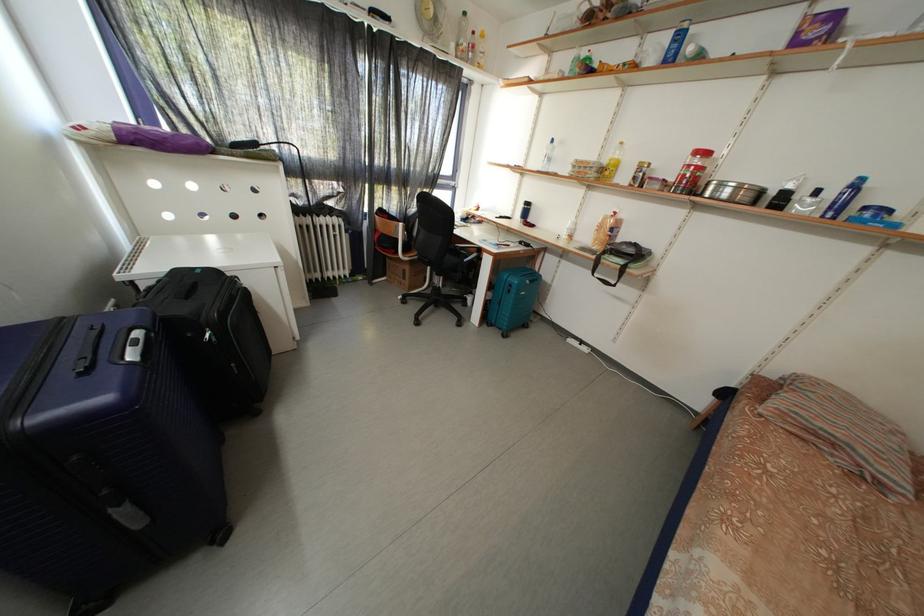
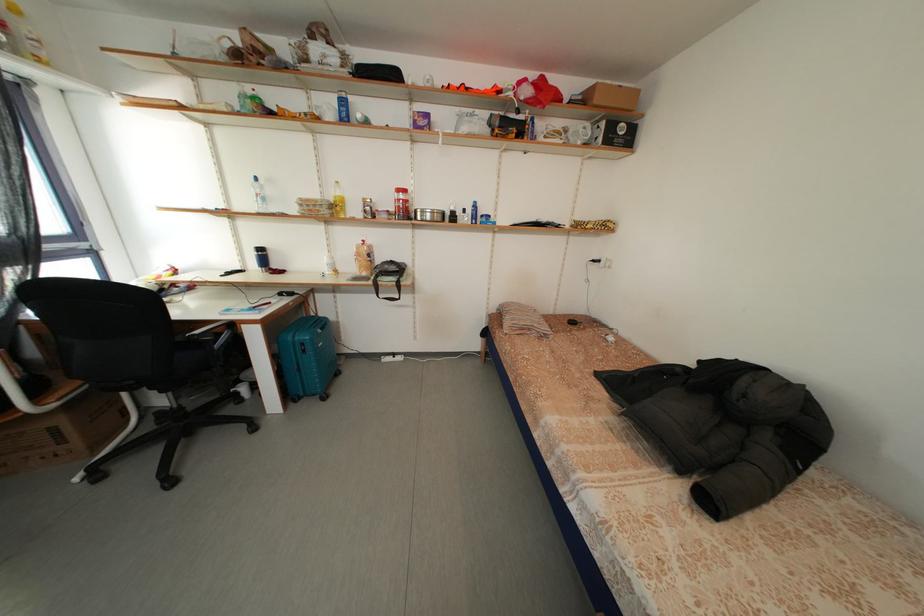
Question: How did the camera likely rotate?

Choices:
 (A) Left
 (B) Right
 (C) Up
 (D) Down

Answer: (B)